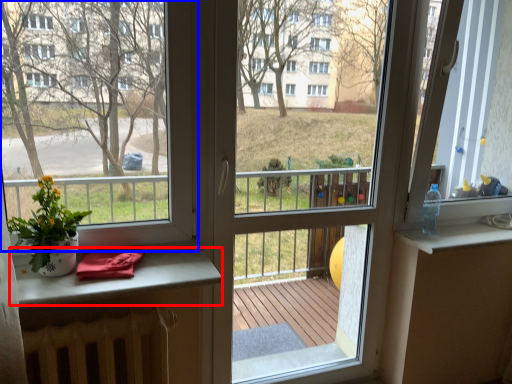
Question: Among these objects, which one is nearest to the camera, table (highlighted by a red box) or window (highlighted by a blue box)?

Choices:
 (A) table
 (B) window

Answer: (B)